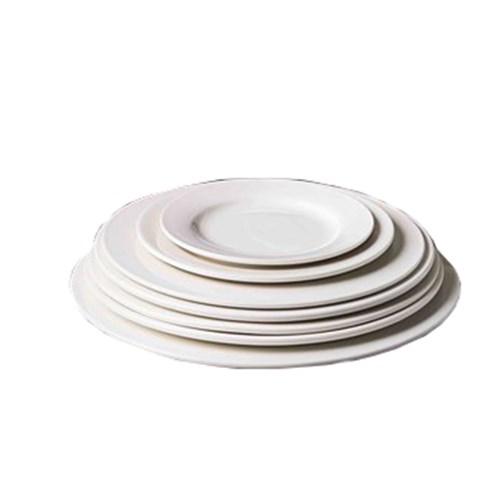
Find the location of a particular element. The height and width of the screenshot is (500, 500). plates is located at coordinates (278, 362), (281, 341), (283, 329), (283, 314), (285, 304), (286, 277), (284, 259).